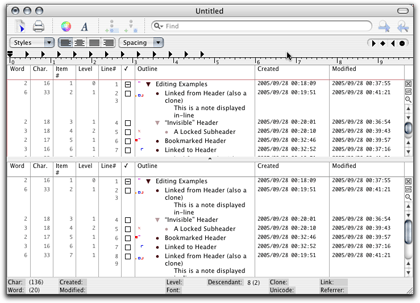
At what (x,y) coordinates should I click in order to perform the action: click on columns. Please return your answer as a coordinate pair (x, y). This screenshot has height=303, width=420. Looking at the image, I should click on click(x=17, y=70), click(x=38, y=71), click(x=59, y=72), click(x=86, y=74), click(x=113, y=73), click(x=125, y=73), click(x=170, y=75), click(x=293, y=74), click(x=363, y=73), click(x=409, y=73).